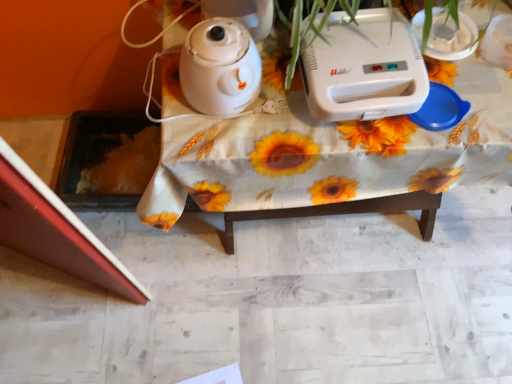
Locate an element on the screen. This screenshot has width=512, height=384. blank space to the left of white glossy kettle at upper center is located at coordinates pyautogui.click(x=166, y=91).